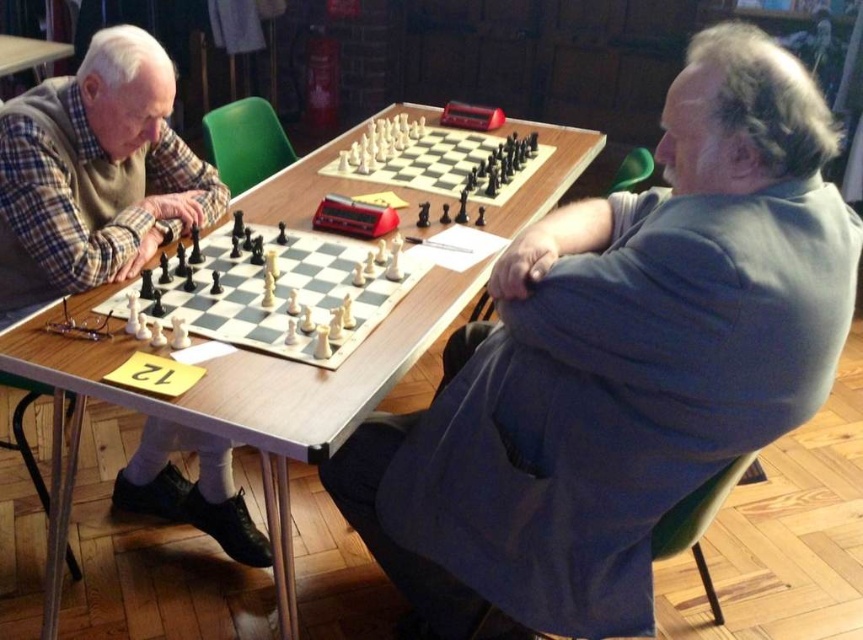
Does matte black chess set at left appear on the right side of white plastic chess pieces at center?

No, matte black chess set at left is not to the right of white plastic chess pieces at center.

Can you confirm if matte black chess set at left is positioned below white plastic chess pieces at center?

Incorrect, matte black chess set at left is not positioned below white plastic chess pieces at center.

Which is behind, point (8, 140) or point (413, 276)?

The point (413, 276) is behind.

Find the location of a particular element. The image size is (863, 640). matte black chess set at left is located at coordinates (96, 172).

Is matte black chess set at left behind wooden chessboard at center?

Yes, matte black chess set at left is further from the viewer.

Describe the element at coordinates (96, 172) in the screenshot. I see `matte black chess set at left` at that location.

Identify the location of matte black chess set at left. (96, 172).

Who is positioned more to the right, matte black chess set at left or white plastic chess set at center?

From the viewer's perspective, white plastic chess set at center appears more on the right side.

Which of these two, matte black chess set at left or white plastic chess set at center, stands shorter?

Standing shorter between the two is white plastic chess set at center.

Is point (156, 115) more distant than point (378, 131)?

No, (156, 115) is closer to viewer.

At what (x,y) coordinates should I click in order to perform the action: click on matte black chess set at left. Please return your answer as a coordinate pair (x, y). Looking at the image, I should click on (96, 172).